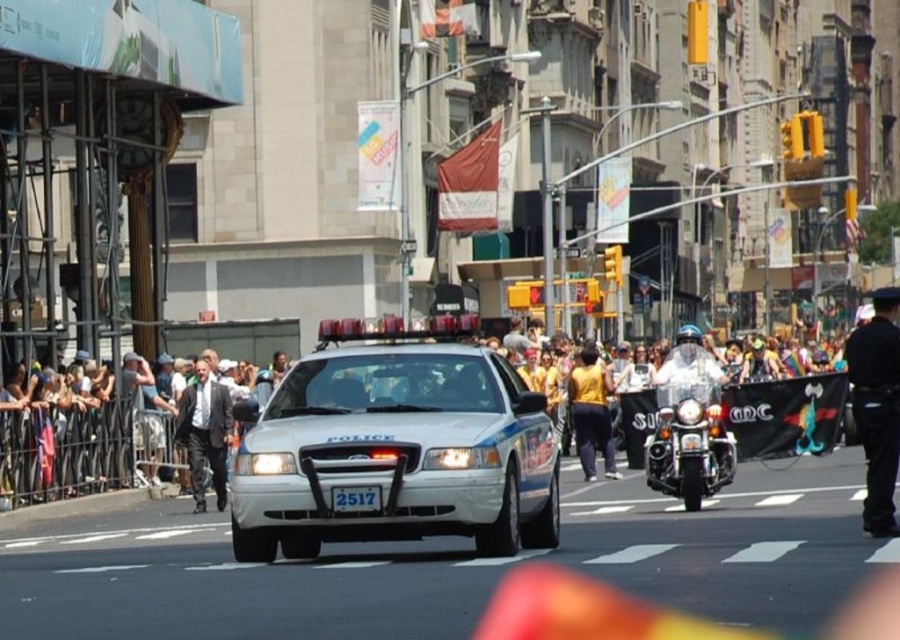
Between white glossy police car at center and white glossy motorcycle at center-right, which one appears on the right side from the viewer's perspective?

From the viewer's perspective, white glossy motorcycle at center-right appears more on the right side.

Between white glossy police car at center and white glossy motorcycle at center-right, which one appears on the left side from the viewer's perspective?

Positioned to the left is white glossy police car at center.

Find the location of a particular element. white glossy police car at center is located at coordinates pyautogui.click(x=396, y=445).

Is white glossy police car at center behind dark suit at left?

No, it is not.

Based on the photo, measure the distance between white glossy police car at center and camera.

They are 70.87 feet apart.

Locate an element on the screen. Image resolution: width=900 pixels, height=640 pixels. white glossy police car at center is located at coordinates (396, 445).

Who is shorter, white glossy motorcycle at center-right or black uniformed officer at right?

Standing shorter between the two is white glossy motorcycle at center-right.

Is white glossy motorcycle at center-right wider than black uniformed officer at right?

In fact, white glossy motorcycle at center-right might be narrower than black uniformed officer at right.

The image size is (900, 640). I want to click on white glossy motorcycle at center-right, so click(689, 424).